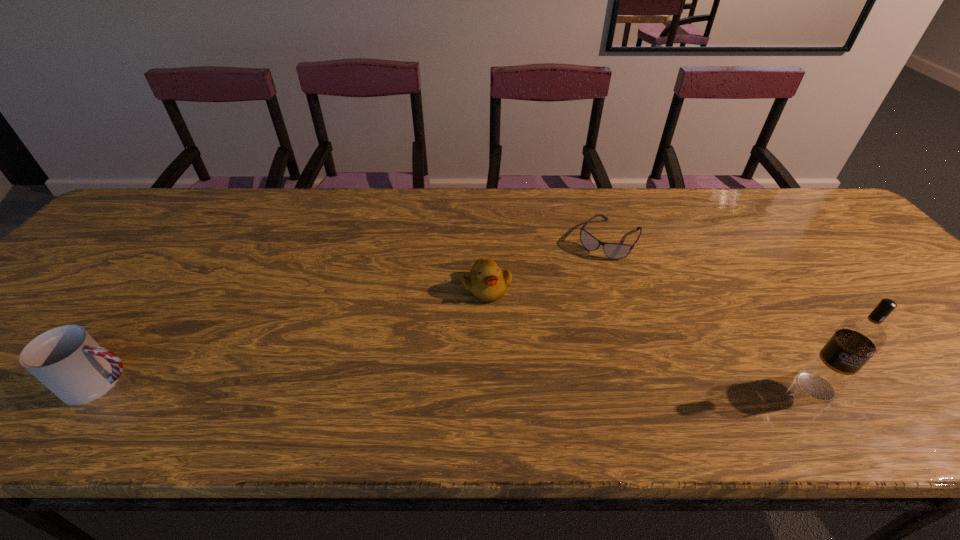
I want to click on vacant space in between the third shortest object and the farthest object, so click(x=356, y=311).

In order to click on free space that is in between the second farthest object and the leftmost object in this screenshot , I will do `click(295, 335)`.

At what (x,y) coordinates should I click in order to perform the action: click on free space between the cup and the duckling. Please return your answer as a coordinate pair (x, y). Image resolution: width=960 pixels, height=540 pixels. Looking at the image, I should click on (295, 335).

Select which object appears as the third closest to the cup. Please provide its 2D coordinates. Your answer should be formatted as a tuple, i.e. [(x, y)], where the tuple contains the x and y coordinates of a point satisfying the conditions above.

[(857, 339)]

This screenshot has width=960, height=540. In order to click on the second closest object to the farthest object in this screenshot , I will do `click(857, 339)`.